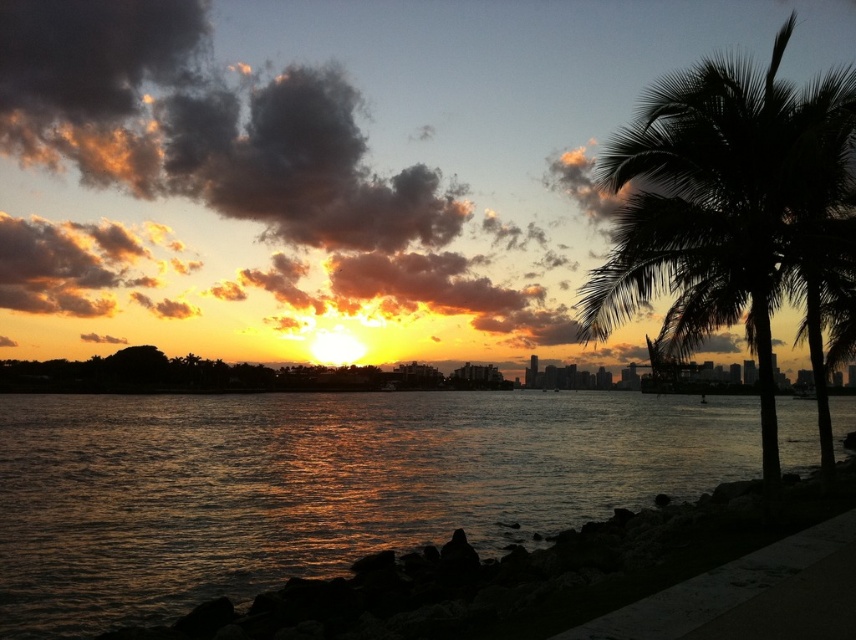
Is point (37, 397) positioned before point (792, 212)?

No, (37, 397) is behind (792, 212).

Looking at this image, is glistening water at lower left thinner than silhouette leafy palm at right?

In fact, glistening water at lower left might be wider than silhouette leafy palm at right.

Is point (0, 593) in front of point (783, 260)?

No, it is behind (783, 260).

Locate an element on the screen. The image size is (856, 640). glistening water at lower left is located at coordinates (314, 483).